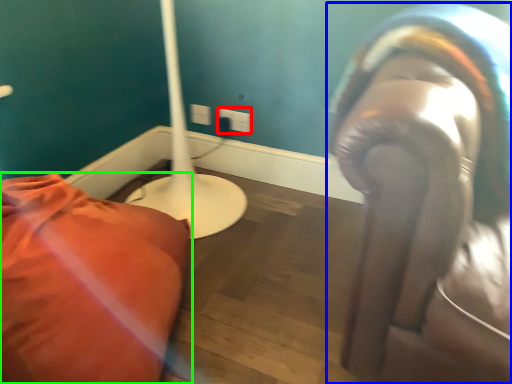
Question: Which is farther away from electric outlet (highlighted by a red box)? person (highlighted by a blue box) or furniture (highlighted by a green box)?

Choices:
 (A) person
 (B) furniture

Answer: (A)